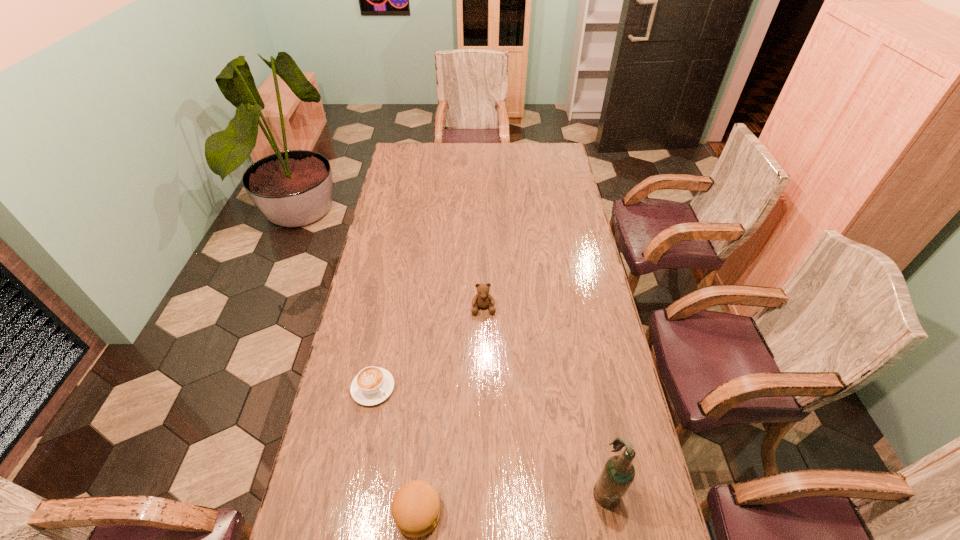
You are a GUI agent. You are given a task and a screenshot of the screen. Output one action in this format:
    pyautogui.click(x=<x>, y=<y>)
    Task: Click on the object that is at the near right corner
    This screenshot has width=960, height=540.
    Given the screenshot: What is the action you would take?
    coord(618,473)

In the image, there is a desktop. Identify the location of free region at the far edge. (452, 157).

This screenshot has width=960, height=540. Find the location of `free location at the left edge of the desktop`. free location at the left edge of the desktop is located at coordinates (399, 193).

Where is `vacant space at the right edge`? vacant space at the right edge is located at coordinates (601, 353).

In the image, there is a desktop. Identify the location of vacant space at the far left corner. (403, 158).

Where is `vacant space at the near right corner of the desktop`? Image resolution: width=960 pixels, height=540 pixels. vacant space at the near right corner of the desktop is located at coordinates (628, 514).

Where is `free space between the second tallest object and the second farthest object`? The height and width of the screenshot is (540, 960). free space between the second tallest object and the second farthest object is located at coordinates pos(428,348).

The width and height of the screenshot is (960, 540). I want to click on free space that is in between the farthest object and the leftmost object, so click(x=428, y=348).

The height and width of the screenshot is (540, 960). In order to click on unoccupied position between the hamburger and the rightmost object in this screenshot , I will do `click(512, 501)`.

Find the location of a particular element. This screenshot has height=540, width=960. free spot between the second object from left to right and the tallest object is located at coordinates (512, 501).